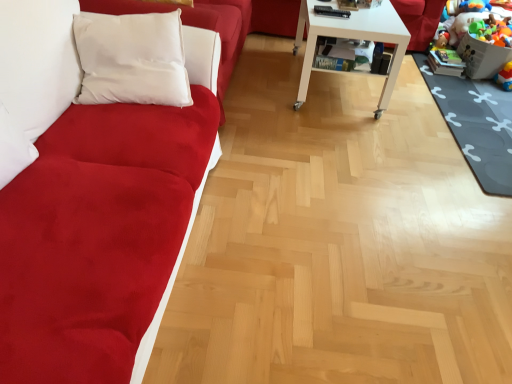
You are a GUI agent. You are given a task and a screenshot of the screen. Output one action in this format:
    pyautogui.click(x=<x>, y=<y>)
    Task: Click on the blank space to the left of white glossy table at center
    This screenshot has height=384, width=512.
    Given the screenshot: What is the action you would take?
    pyautogui.click(x=265, y=79)